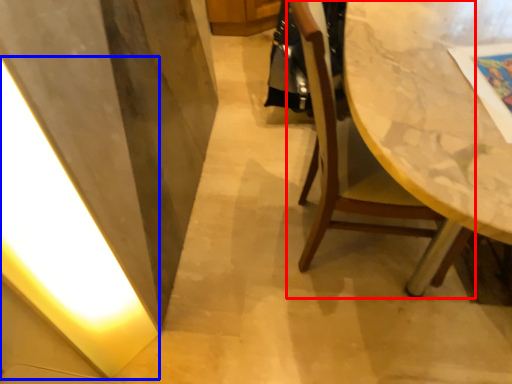
Question: Among these objects, which one is nearest to the camera, chair (highlighted by a red box) or light (highlighted by a blue box)?

Choices:
 (A) chair
 (B) light

Answer: (B)